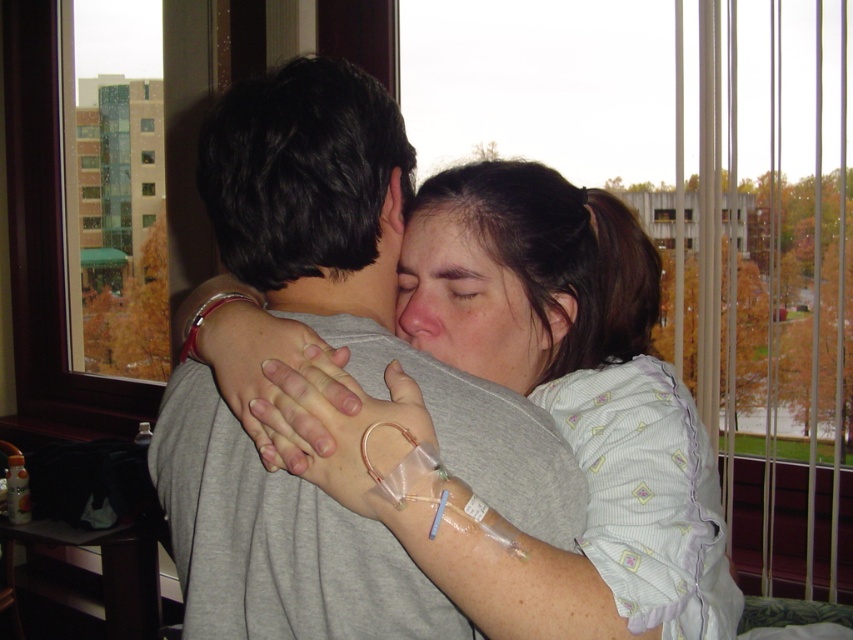
Between gray matte shirt at center and matte skin forehead at center, which one is positioned lower?

gray matte shirt at center is lower down.

How distant is gray matte shirt at center from matte skin forehead at center?

18.05 centimeters

Locate an element on the screen. This screenshot has height=640, width=853. gray matte shirt at center is located at coordinates (550, 416).

Locate an element on the screen. The width and height of the screenshot is (853, 640). gray matte shirt at center is located at coordinates (550, 416).

Can you confirm if gray matte shirt at center is wider than smooth skin face at center?

Yes.

What do you see at coordinates (550, 416) in the screenshot? I see `gray matte shirt at center` at bounding box center [550, 416].

Find the location of a particular element. gray matte shirt at center is located at coordinates (550, 416).

Which is more to the left, smooth skin face at center or matte skin forehead at center?

From the viewer's perspective, matte skin forehead at center appears more on the left side.

Who is taller, smooth skin face at center or matte skin forehead at center?

Standing taller between the two is smooth skin face at center.

This screenshot has width=853, height=640. What are the coordinates of `smooth skin face at center` in the screenshot? It's located at (471, 304).